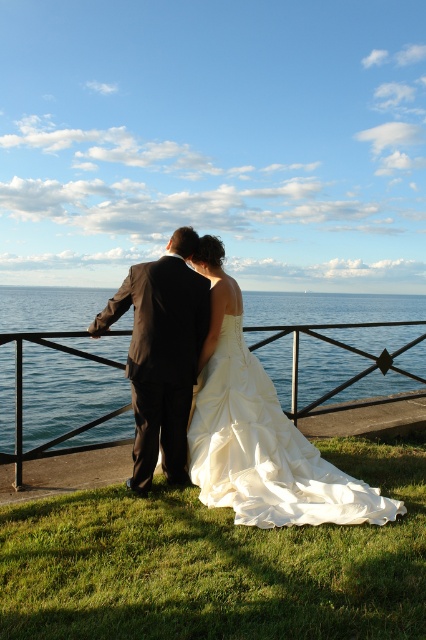
Does matte white gown at center lie in front of black metal railing at center?

Yes.

Does matte white gown at center appear over black metal railing at center?

Yes.

Which is in front, point (345, 500) or point (420, 339)?

Point (345, 500) is more forward.

The image size is (426, 640). What are the coordinates of `matte white gown at center` in the screenshot? It's located at (259, 432).

Between matte white gown at center and dark gray suit at center, which one appears on the right side from the viewer's perspective?

matte white gown at center is more to the right.

Which is more to the left, matte white gown at center or dark gray suit at center?

From the viewer's perspective, dark gray suit at center appears more on the left side.

Which is in front, point (212, 448) or point (175, 326)?

Point (175, 326)

Find the location of `matte white gown at center`. matte white gown at center is located at coordinates (259, 432).

Who is positioned more to the left, matte white gown at center or ivory satin gown at center?

matte white gown at center

Does matte white gown at center appear on the right side of ivory satin gown at center?

No, matte white gown at center is not to the right of ivory satin gown at center.

Who is more forward, (362,509) or (391,504)?

Positioned in front is point (362,509).

You are a GUI agent. You are given a task and a screenshot of the screen. Output one action in this format:
    pyautogui.click(x=<x>, y=<y>)
    Task: Click on the matte white gown at center
    The height and width of the screenshot is (640, 426).
    Given the screenshot: What is the action you would take?
    pyautogui.click(x=259, y=432)